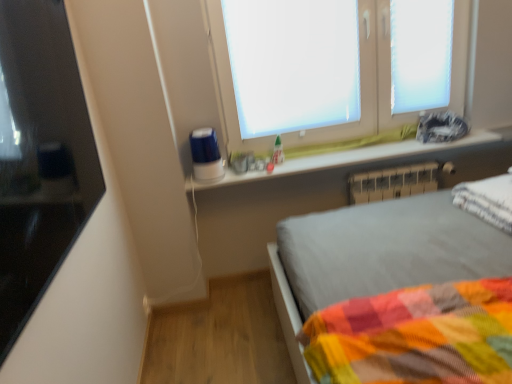
What do you see at coordinates (293, 63) in the screenshot? I see `white matte window screen at upper center` at bounding box center [293, 63].

The image size is (512, 384). What do you see at coordinates (393, 183) in the screenshot?
I see `white plastic radiator at lower right` at bounding box center [393, 183].

In order to click on black glossy monitor at left in this screenshot , I will do `click(40, 156)`.

Describe the element at coordinates (40, 156) in the screenshot. This screenshot has width=512, height=384. I see `black glossy monitor at left` at that location.

I want to click on white frosted glass window at upper center, so click(x=366, y=81).

Describe the element at coordinates (366, 81) in the screenshot. I see `white frosted glass window at upper center` at that location.

Image resolution: width=512 pixels, height=384 pixels. In order to click on white glossy window sill at upper center in this screenshot , I will do `click(378, 153)`.

The image size is (512, 384). I want to click on white plastic window frame at upper right, so click(420, 54).

Identify the location of white soft pillow at right. This screenshot has height=384, width=512. (487, 200).

Is white frosted glass window at upper center shorter than white plastic window frame at upper right?

No.

Is white frosted glass window at upper center with white plastic window frame at upper right?

No, white frosted glass window at upper center is not in contact with white plastic window frame at upper right.

In the image, there is a white frosted glass window at upper center. Where is `window frame above it (from the image's perspective)`? Image resolution: width=512 pixels, height=384 pixels. window frame above it (from the image's perspective) is located at coordinates (420, 54).

Could you tell me if white frosted glass window at upper center is facing white plastic window frame at upper right?

Yes, white frosted glass window at upper center is facing white plastic window frame at upper right.

In the scene shown: Considering the sizes of objects white frosted glass window at upper center and white plastic radiator at lower right in the image provided, who is wider, white frosted glass window at upper center or white plastic radiator at lower right?

white plastic radiator at lower right is wider.

Does white frosted glass window at upper center lie in front of white plastic radiator at lower right?

Yes, white frosted glass window at upper center is closer to the camera.

Can you see white frosted glass window at upper center touching white plastic radiator at lower right?

white frosted glass window at upper center and white plastic radiator at lower right are not in contact.

From a real-world perspective, which object rests below the other?

In real-world perspective, white plastic radiator at lower right is lower.

In the image, is white soft pillow at right positioned in front of or behind white plastic window frame at upper right?

white soft pillow at right is in front of white plastic window frame at upper right.

Is white soft pillow at right spatially inside white plastic window frame at upper right, or outside of it?

The correct answer is: outside.

From the image's perspective, which is above, white plastic radiator at lower right or white plastic window frame at upper right?

white plastic window frame at upper right, from the image's perspective.

Is white plastic radiator at lower right positioned far away from white plastic window frame at upper right?

That's not correct — white plastic radiator at lower right is a little close to white plastic window frame at upper right.

Which object is further away from the camera, white plastic radiator at lower right or white plastic window frame at upper right?

white plastic radiator at lower right is more distant.

Is white plastic radiator at lower right looking in the opposite direction of white plastic window frame at upper right?

No, white plastic radiator at lower right is not facing the opposite direction of white plastic window frame at upper right.

From the image's perspective, does white glossy window sill at upper center appear lower than black glossy monitor at left?

Answer: No, from the image's perspective, white glossy window sill at upper center is not below black glossy monitor at left.

Is point (236, 177) positioned after point (5, 45)?

Yes, it is behind point (5, 45).

Considering the relative sizes of white glossy window sill at upper center and black glossy monitor at left in the image provided, is white glossy window sill at upper center wider than black glossy monitor at left?

Indeed, white glossy window sill at upper center has a greater width compared to black glossy monitor at left.

Is white matte window screen at upper center placed right next to black glossy monitor at left?

No, white matte window screen at upper center is not in contact with black glossy monitor at left.

From the picture: Is white matte window screen at upper center not inside black glossy monitor at left?

white matte window screen at upper center is positioned outside black glossy monitor at left.

Between white matte window screen at upper center and black glossy monitor at left, which one appears on the right side from the viewer's perspective?

Positioned to the right is white matte window screen at upper center.

Which object is thinner, white matte window screen at upper center or black glossy monitor at left?

white matte window screen at upper center.

Which of these two, white glossy window sill at upper center or white matte window screen at upper center, is smaller?

white glossy window sill at upper center is smaller.

At what (x,y) coordinates should I click in order to perform the action: click on window screen lying on the left of white glossy window sill at upper center. Please return your answer as a coordinate pair (x, y). The image size is (512, 384). Looking at the image, I should click on (293, 63).

Is white glossy window sill at upper center oriented towards white matte window screen at upper center?

No, white glossy window sill at upper center is not turned towards white matte window screen at upper center.

In order to click on window frame located on the right of white frosted glass window at upper center in this screenshot , I will do `click(420, 54)`.

The width and height of the screenshot is (512, 384). What are the coordinates of `window on the left of white plastic radiator at lower right` in the screenshot? It's located at (366, 81).

Based on their spatial positions, is black glossy monitor at left or white plastic radiator at lower right closer to white soft pillow at right?

white plastic radiator at lower right.

Considering their positions, is black glossy monitor at left positioned closer to white frosted glass window at upper center than white matte window screen at upper center?

white matte window screen at upper center.

When comparing their distances from white plastic window frame at upper right, does white plastic radiator at lower right or white soft pillow at right seem further?

Based on the image, white soft pillow at right appears to be further to white plastic window frame at upper right.

From the image, which object appears to be farther from white plastic radiator at lower right, black glossy monitor at left or white frosted glass window at upper center?

black glossy monitor at left is further to white plastic radiator at lower right.

Estimate the real-world distances between objects in this image. Which object is closer to white plastic radiator at lower right, white glossy window sill at upper center or white matte window screen at upper center?

The object closer to white plastic radiator at lower right is white glossy window sill at upper center.

In the scene shown: Based on their spatial positions, is white frosted glass window at upper center or white matte window screen at upper center further from black glossy monitor at left?

The object further to black glossy monitor at left is white frosted glass window at upper center.

Estimate the real-world distances between objects in this image. Which object is further from white plastic radiator at lower right, white soft pillow at right or white matte window screen at upper center?

Based on the image, white matte window screen at upper center appears to be further to white plastic radiator at lower right.

Which object lies nearer to the anchor point white matte window screen at upper center, white plastic window frame at upper right or white plastic radiator at lower right?

Among the two, white plastic window frame at upper right is located nearer to white matte window screen at upper center.

I want to click on window sill between white soft pillow at right and white plastic radiator at lower right along the z-axis, so click(x=378, y=153).

Identify the location of window screen between black glossy monitor at left and white plastic radiator at lower right along the z-axis. coord(293,63).

In order to click on radiator between white plastic window frame at upper right and white soft pillow at right from top to bottom in this screenshot , I will do pyautogui.click(x=393, y=183).

Where is `window that lies between white matte window screen at upper center and white plastic radiator at lower right from top to bottom`? window that lies between white matte window screen at upper center and white plastic radiator at lower right from top to bottom is located at coordinates (366, 81).